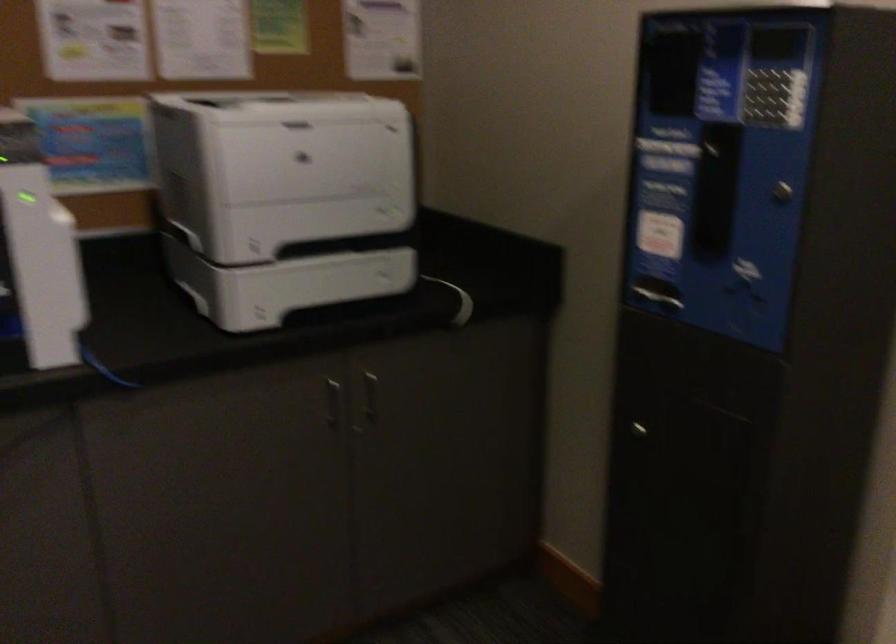
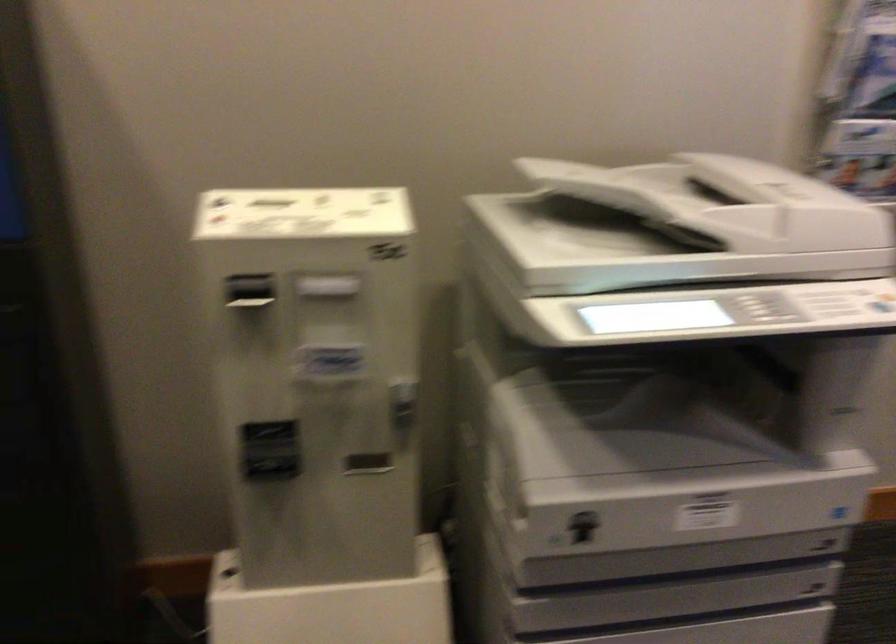
The images are taken continuously from a first-person perspective. In which direction is your viewpoint rotating?

The camera rotated toward right-down.